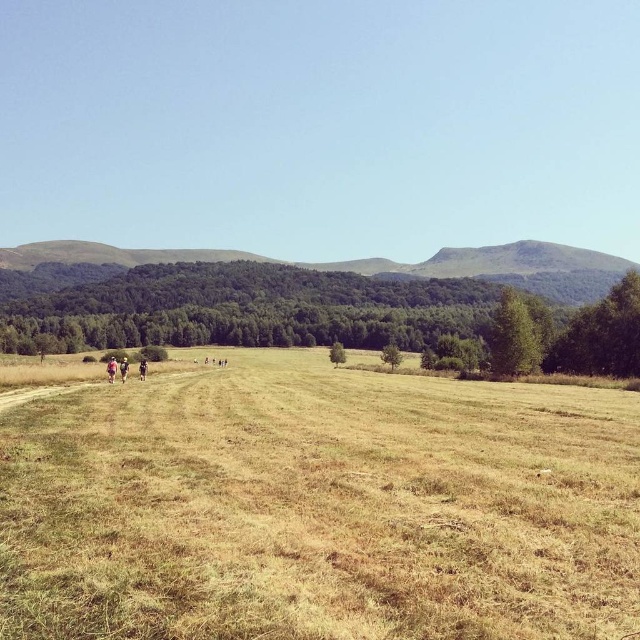
You are standing on the brown grassy field at center and want to see the light brown fabric jacket at left clearly. Which direction should you walk to get a better view?

The light brown fabric jacket at left is closer to you than the brown grassy field at center, so you should walk towards the light brown fabric jacket at left to get a better view.

You are standing on the dirt path in the rural landscape and see the light blue fabric at left and the light brown leather jacket at center. Which object is higher up in the image?

The light blue fabric at left is above the light brown leather jacket at center in the image.

You are a hiker who wants to choose between the light brown fabric jacket at left and the light brown leather jacket at center. Which jacket is bigger?

The light brown fabric jacket at left is larger in size than the light brown leather jacket at center.